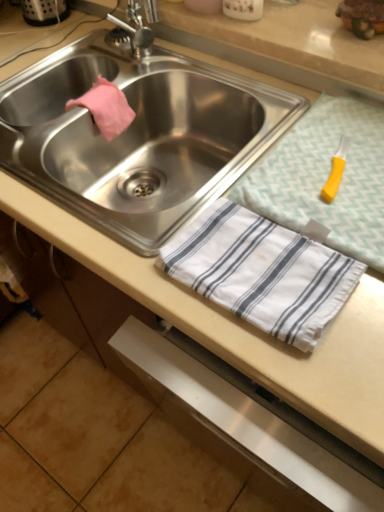
Question: Considering the relative positions of yellow plastic knife at upper right and stainless steel sink at center in the image provided, is yellow plastic knife at upper right in front of stainless steel sink at center?

Choices:
 (A) yes
 (B) no

Answer: (A)

Question: Does yellow plastic knife at upper right have a lesser width compared to stainless steel sink at center?

Choices:
 (A) no
 (B) yes

Answer: (B)

Question: Considering the relative positions of yellow plastic knife at upper right and stainless steel sink at center in the image provided, is yellow plastic knife at upper right behind stainless steel sink at center?

Choices:
 (A) no
 (B) yes

Answer: (A)

Question: Is yellow plastic knife at upper right aimed at stainless steel sink at center?

Choices:
 (A) no
 (B) yes

Answer: (A)

Question: Is yellow plastic knife at upper right turned away from stainless steel sink at center?

Choices:
 (A) yes
 (B) no

Answer: (B)

Question: Considering the relative sizes of yellow plastic knife at upper right and stainless steel sink at center in the image provided, is yellow plastic knife at upper right shorter than stainless steel sink at center?

Choices:
 (A) no
 (B) yes

Answer: (B)

Question: Does stainless steel sink at center have a greater height compared to yellow plastic knife at upper right?

Choices:
 (A) yes
 (B) no

Answer: (A)

Question: Is stainless steel sink at center at the left side of yellow plastic knife at upper right?

Choices:
 (A) yes
 (B) no

Answer: (A)

Question: From the image's perspective, does stainless steel sink at center appear lower than yellow plastic knife at upper right?

Choices:
 (A) yes
 (B) no

Answer: (B)

Question: From a real-world perspective, is stainless steel sink at center positioned under yellow plastic knife at upper right based on gravity?

Choices:
 (A) no
 (B) yes

Answer: (B)

Question: Is stainless steel sink at center not within yellow plastic knife at upper right?

Choices:
 (A) no
 (B) yes

Answer: (B)

Question: Is stainless steel sink at center to the right of yellow plastic knife at upper right from the viewer's perspective?

Choices:
 (A) yes
 (B) no

Answer: (B)

Question: Is stainless steel sink at center wider or thinner than yellow plastic knife at upper right?

Choices:
 (A) thin
 (B) wide

Answer: (B)